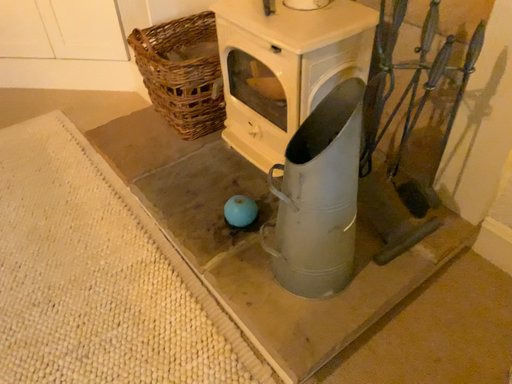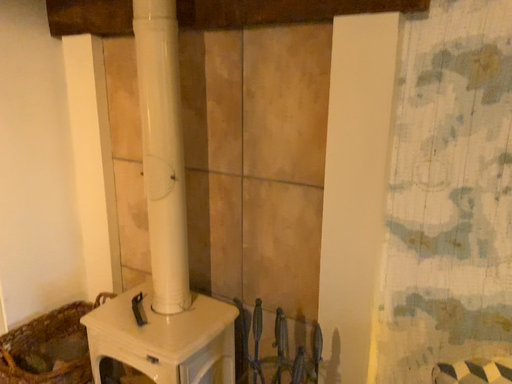
Question: How did the camera likely rotate when shooting the video?

Choices:
 (A) rotated left
 (B) rotated right

Answer: (B)